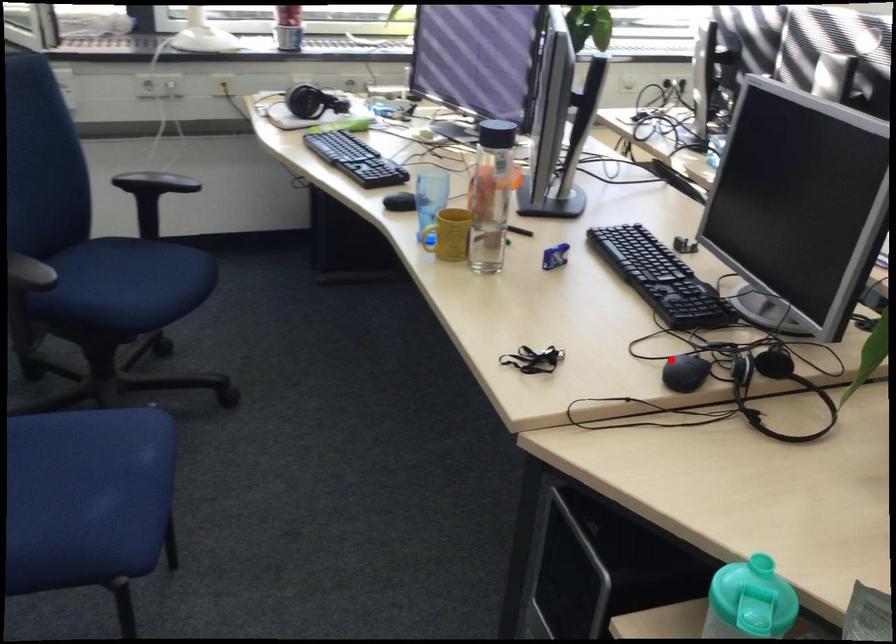
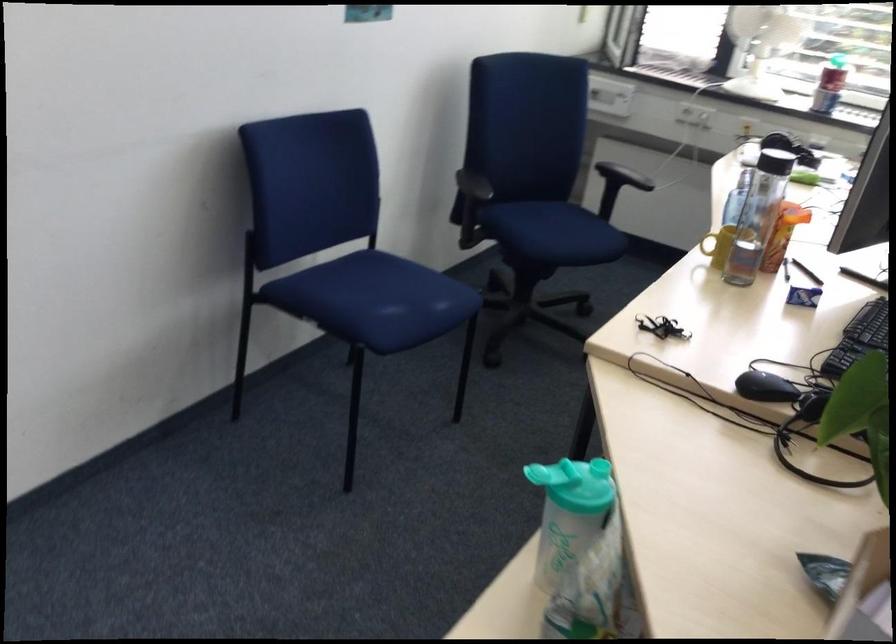
Find the pixel in the second image that matches the highlighted location in the first image.

(765, 386)